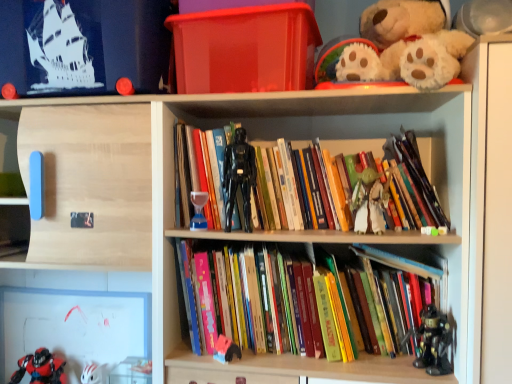
Question: Is shiny red plastic toy at lower left, the first toy in the bottom-to-top sequence, facing away from plush pink and blue toy at center, which appears as the fourth toy when viewed from the left?

Choices:
 (A) yes
 (B) no

Answer: (B)

Question: Is shiny red plastic toy at lower left, which is counted as the seventh toy, starting from the top, wider than plush pink and blue toy at center, the third toy when ordered from bottom to top?

Choices:
 (A) no
 (B) yes

Answer: (B)

Question: From the image's perspective, is shiny red plastic toy at lower left, which is the seventh toy from right to left, under plush pink and blue toy at center, the third toy when ordered from bottom to top?

Choices:
 (A) no
 (B) yes

Answer: (B)

Question: Does shiny red plastic toy at lower left, the first toy in the bottom-to-top sequence, have a lesser width compared to plush pink and blue toy at center, which is the 4th toy from right to left?

Choices:
 (A) yes
 (B) no

Answer: (B)

Question: Is shiny red plastic toy at lower left, which is the seventh toy from right to left, outside plush pink and blue toy at center, which is the 4th toy from right to left?

Choices:
 (A) no
 (B) yes

Answer: (B)

Question: From the image's perspective, is shiny red plastic toy at lower left, which is the seventh toy from right to left, above plush pink and blue toy at center, which appears as the fourth toy when viewed from the left?

Choices:
 (A) no
 (B) yes

Answer: (A)

Question: Does transparent plastic box at upper center turn towards green fabric yoda at center, acting as the 2th toy starting from the top?

Choices:
 (A) yes
 (B) no

Answer: (B)

Question: Is transparent plastic box at upper center not close to green fabric yoda at center, which is the sixth toy from left to right?

Choices:
 (A) no
 (B) yes

Answer: (A)

Question: From the image's perspective, is transparent plastic box at upper center over green fabric yoda at center, which is the sixth toy from left to right?

Choices:
 (A) yes
 (B) no

Answer: (A)

Question: Is transparent plastic box at upper center taller than green fabric yoda at center, which is the sixth toy from left to right?

Choices:
 (A) yes
 (B) no

Answer: (A)

Question: Does transparent plastic box at upper center come in front of green fabric yoda at center, arranged as the 6th toy when ordered from the bottom?

Choices:
 (A) yes
 (B) no

Answer: (A)

Question: Considering the relative positions of transparent plastic box at upper center and green fabric yoda at center, arranged as the 6th toy when ordered from the bottom, in the image provided, is transparent plastic box at upper center to the right of green fabric yoda at center, arranged as the 6th toy when ordered from the bottom, from the viewer's perspective?

Choices:
 (A) yes
 (B) no

Answer: (B)

Question: From the image's perspective, is green fabric yoda at center, the 2th toy from the right, beneath hardcover books at center, the 2th book viewed from the top?

Choices:
 (A) no
 (B) yes

Answer: (A)